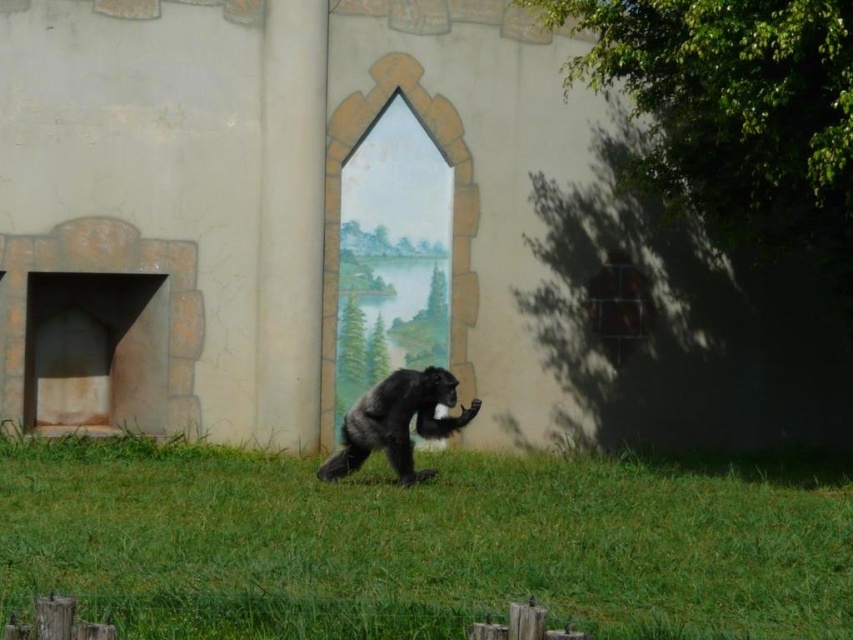
Who is positioned more to the right, green grass at center or shiny black ape at center?

green grass at center is more to the right.

Is green grass at center further to camera compared to shiny black ape at center?

No, it is in front of shiny black ape at center.

What do you see at coordinates (418, 545) in the screenshot? The height and width of the screenshot is (640, 853). I see `green grass at center` at bounding box center [418, 545].

Where is `green grass at center`? This screenshot has height=640, width=853. green grass at center is located at coordinates (418, 545).